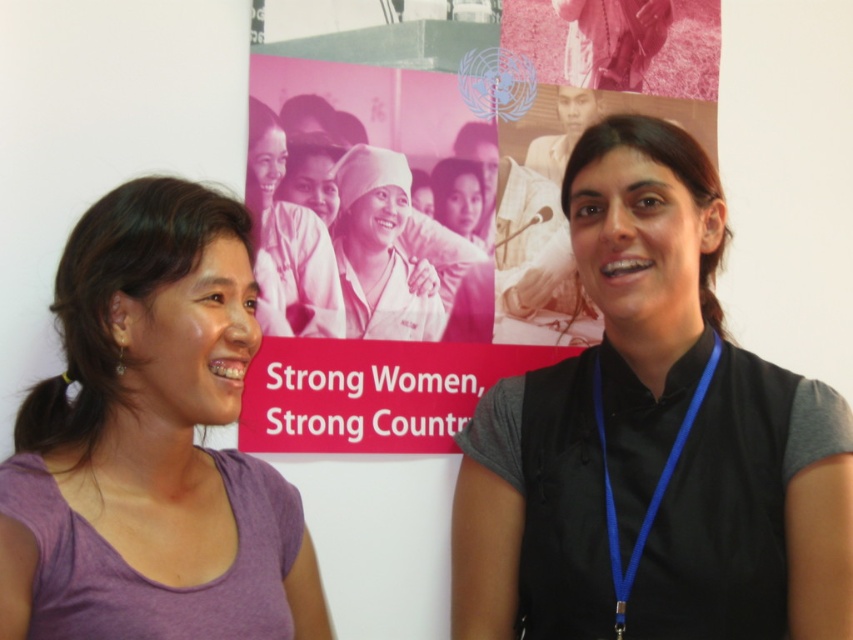
Which is behind, point (364, 176) or point (267, 200)?

Positioned behind is point (364, 176).

Which of these two, white cotton hat at center or matte pink uniform at center, stands taller?

With more height is matte pink uniform at center.

Who is more forward, (384, 248) or (263, 300)?

Positioned in front is point (263, 300).

The image size is (853, 640). I want to click on white cotton hat at center, so click(381, 252).

Is point (593, 330) behind point (637, 556)?

Yes, it is.

Is the position of pink glossy poster at center more distant than that of blue fabric lanyard at right?

Yes, it is behind blue fabric lanyard at right.

Is point (511, 26) behind point (599, 385)?

Yes, point (511, 26) is farther from viewer.

This screenshot has height=640, width=853. Find the location of `pink glossy poster at center`. pink glossy poster at center is located at coordinates (444, 202).

Is matte pink uniform at center bigger than blue fabric lanyard at right?

Actually, matte pink uniform at center might be smaller than blue fabric lanyard at right.

How much distance is there between matte pink uniform at center and blue fabric lanyard at right?

They are 25.25 inches apart.

Is point (258, 193) farther from camera compared to point (619, 552)?

Yes, it is behind point (619, 552).

Find the location of a particular element. The image size is (853, 640). matte pink uniform at center is located at coordinates (288, 243).